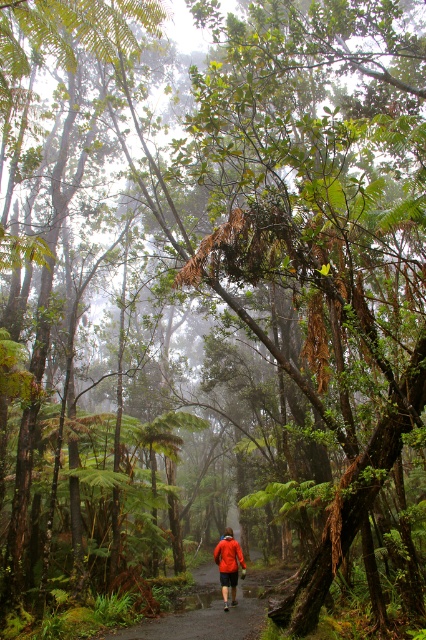
You are a hiker who wants to take a photo of the dark brown dirt path at center and the red fabric jacket at center in the misty forest. Can you fit both objects in the frame of your camera without moving your position?

The dark brown dirt path at center and red fabric jacket at center are 5.63 feet apart from each other. Since the distance between them is 5.63 feet, and assuming a typical camera lens can capture objects within a certain field of view, it is possible to fit both in the frame without moving your position, provided the camera is positioned appropriately to encompass both objects at that distance.

You are a hiker trying to stay dry during a rainstorm. You see the dark brown dirt path at center and the red fabric jacket at center. Which object is bigger and could potentially provide more coverage to shelter under?

The dark brown dirt path at center is larger in size than the red fabric jacket at center, so it could potentially provide more coverage to shelter under.